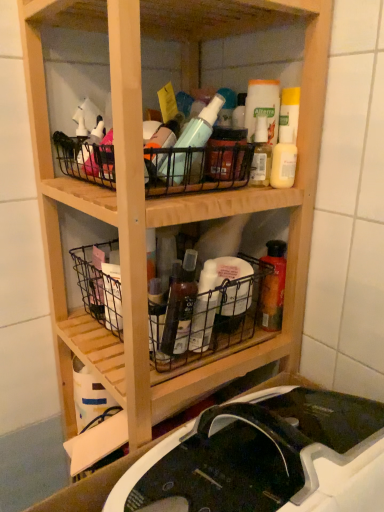
The image size is (384, 512). I want to click on vacant area on top of black plastic sink at lower center (from a real-world perspective), so click(x=179, y=461).